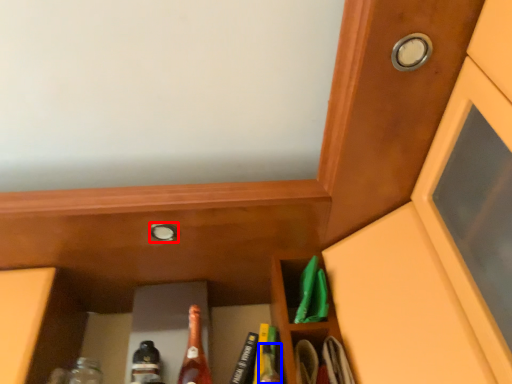
Question: Which object is closer to the camera taking this photo, knob (highlighted by a red box) or bottle (highlighted by a blue box)?

Choices:
 (A) knob
 (B) bottle

Answer: (B)